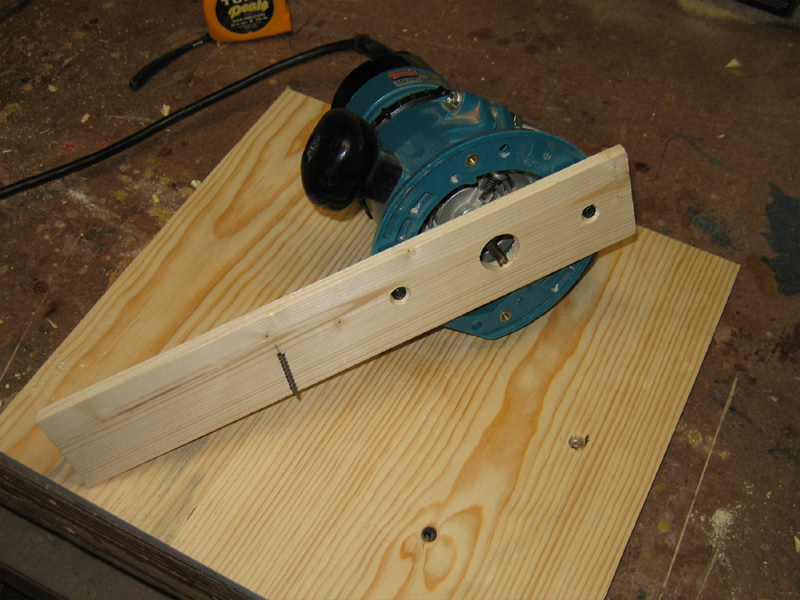
Where is `wood grain`? wood grain is located at coordinates [x=473, y=451].